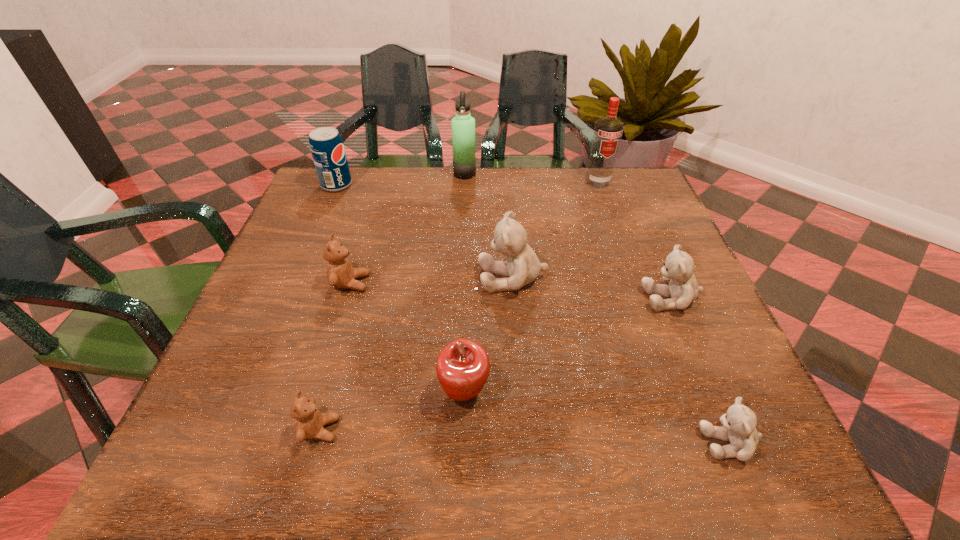
Locate an element on the screen. This screenshot has height=540, width=960. teddy bear that is positioned at the left edge is located at coordinates (340, 274).

The image size is (960, 540). I want to click on vodka that is at the right edge, so click(x=608, y=131).

Where is `object at the far left corner`? The image size is (960, 540). object at the far left corner is located at coordinates (327, 148).

Where is `object present at the far right corner`? The height and width of the screenshot is (540, 960). object present at the far right corner is located at coordinates (608, 131).

At what (x,y) coordinates should I click in order to perform the action: click on object positioned at the near right corner. Please return your answer as a coordinate pair (x, y). The height and width of the screenshot is (540, 960). Looking at the image, I should click on (738, 427).

In the image, there is a desktop. Where is `vacant region at the far edge`? The height and width of the screenshot is (540, 960). vacant region at the far edge is located at coordinates (380, 211).

I want to click on vacant space at the near edge of the desktop, so click(400, 438).

Locate an element on the screen. blank space at the right edge is located at coordinates (719, 382).

Identify the location of vacant space at the far left corner. (355, 215).

Find the location of a particular element. The height and width of the screenshot is (540, 960). vacant area between the nearest gray teddy bear and the smaller brown teddy bear is located at coordinates (525, 436).